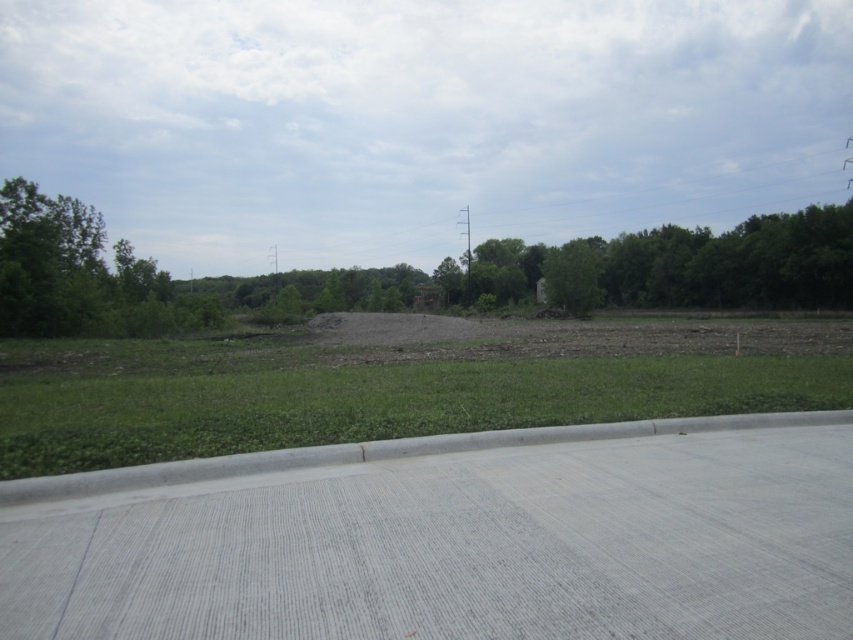
Question: Which object is farther from the camera taking this photo?

Choices:
 (A) green grass at center
 (B) brown soil at center

Answer: (B)

Question: Considering the relative positions of green grass at center and brown soil at center in the image provided, where is green grass at center located with respect to brown soil at center?

Choices:
 (A) right
 (B) left

Answer: (B)

Question: Is green grass at center smaller than brown soil at center?

Choices:
 (A) yes
 (B) no

Answer: (A)

Question: Is green grass at center thinner than brown soil at center?

Choices:
 (A) yes
 (B) no

Answer: (A)